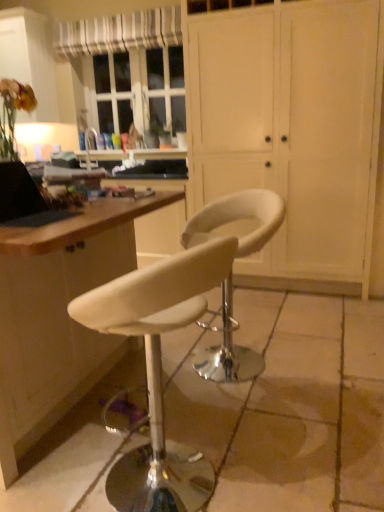
Question: Does white striped fabric at upper left have a larger size compared to black matte laptop at left?

Choices:
 (A) no
 (B) yes

Answer: (B)

Question: Is white striped fabric at upper left outside black matte laptop at left?

Choices:
 (A) no
 (B) yes

Answer: (B)

Question: From the image's perspective, is white striped fabric at upper left below black matte laptop at left?

Choices:
 (A) yes
 (B) no

Answer: (B)

Question: Does white striped fabric at upper left turn towards black matte laptop at left?

Choices:
 (A) yes
 (B) no

Answer: (B)

Question: Can black matte laptop at left be found inside white striped fabric at upper left?

Choices:
 (A) no
 (B) yes

Answer: (A)

Question: From a real-world perspective, relative to white matte cabinet at center, is white striped fabric at upper left vertically above or below?

Choices:
 (A) above
 (B) below

Answer: (A)

Question: Is white striped fabric at upper left inside the boundaries of white matte cabinet at center, or outside?

Choices:
 (A) inside
 (B) outside

Answer: (B)

Question: Considering the positions of point (67, 26) and point (226, 13), is point (67, 26) closer or farther from the camera than point (226, 13)?

Choices:
 (A) farther
 (B) closer

Answer: (A)

Question: Looking at the image, does white striped fabric at upper left seem bigger or smaller compared to white matte cabinet at center?

Choices:
 (A) small
 (B) big

Answer: (A)

Question: In terms of width, does black matte laptop at left look wider or thinner when compared to white leather stool at center, which appears as the first chair when viewed from the back?

Choices:
 (A) thin
 (B) wide

Answer: (A)

Question: Relative to white leather stool at center, placed as the second chair when sorted from front to back, is black matte laptop at left in front or behind?

Choices:
 (A) behind
 (B) front

Answer: (B)

Question: From a real-world perspective, is black matte laptop at left physically located above or below white leather stool at center, placed as the second chair when sorted from front to back?

Choices:
 (A) above
 (B) below

Answer: (A)

Question: Does point (11, 188) appear closer or farther from the camera than point (215, 229)?

Choices:
 (A) farther
 (B) closer

Answer: (B)

Question: From their relative heights in the image, would you say white leather stool at center, which appears as the 2th chair when viewed from the back, is taller or shorter than matte white cabinet at upper left?

Choices:
 (A) tall
 (B) short

Answer: (B)

Question: Is white leather stool at center, which appears as the 2th chair when viewed from the back, bigger or smaller than matte white cabinet at upper left?

Choices:
 (A) small
 (B) big

Answer: (A)